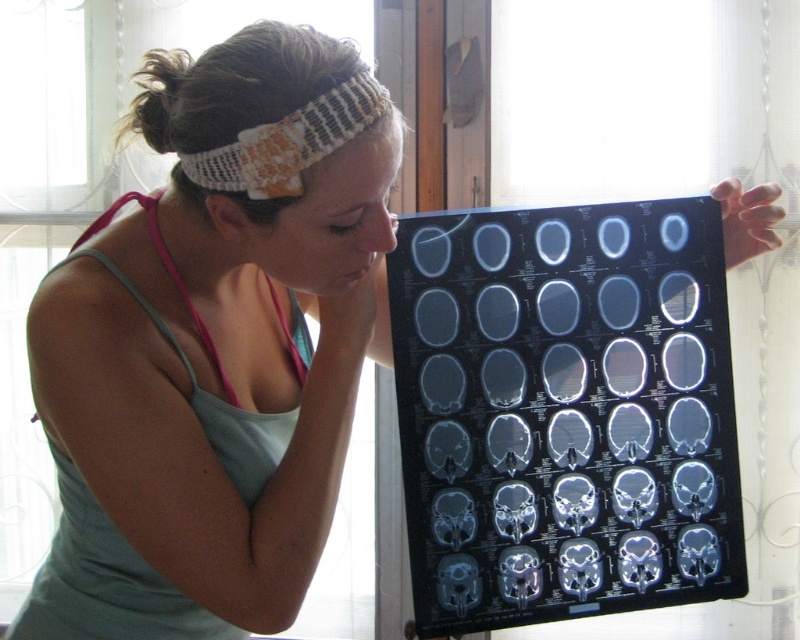
The woman in the scene is wearing both a white knitted headscarf at upper center and a white knitted headband at upper center. Which one is closer to the viewer?

The white knitted headscarf at upper center is closer to the viewer because it is in front of the white knitted headband at upper center.

You are a medical student observing the scene. You notice a point at coordinates (289, 141). What object is located at that point?

The point at coordinates (289, 141) indicates the white knitted headscarf at upper center.